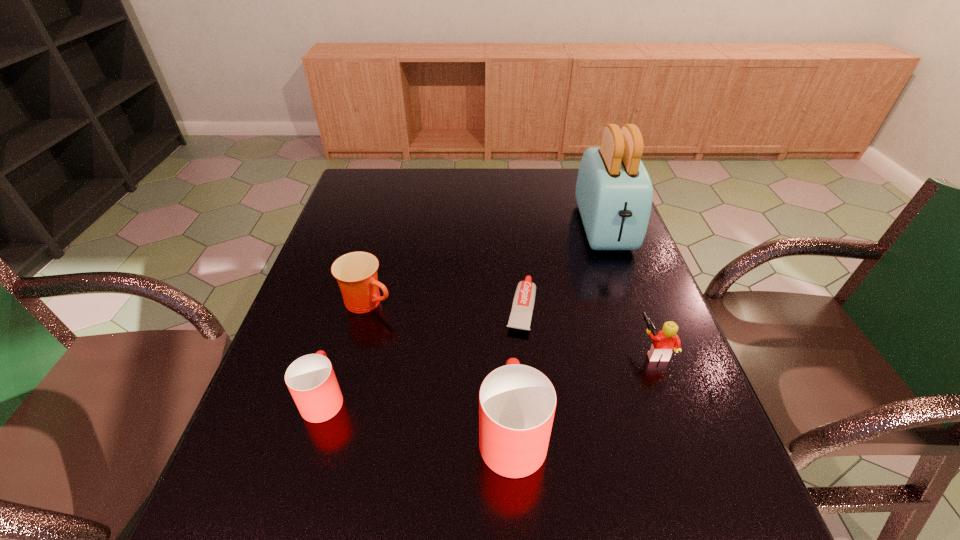
Where is `free spot located on the side of the farthest object with the lever`? Image resolution: width=960 pixels, height=540 pixels. free spot located on the side of the farthest object with the lever is located at coordinates (658, 379).

You are a GUI agent. You are given a task and a screenshot of the screen. Output one action in this format:
    pyautogui.click(x=<x>, y=<y>)
    Task: Click on the blank area located in front of the Lego with the accessory visible
    The height and width of the screenshot is (540, 960).
    Given the screenshot: What is the action you would take?
    pyautogui.click(x=546, y=350)

At what (x,y) coordinates should I click in order to perform the action: click on free spot located in front of the Lego with the accessory visible. Please return your answer as a coordinate pair (x, y). Image resolution: width=960 pixels, height=540 pixels. Looking at the image, I should click on pyautogui.click(x=594, y=350).

This screenshot has height=540, width=960. Find the location of `vacant region located in front of the Lego with the accessory visible`. vacant region located in front of the Lego with the accessory visible is located at coordinates (497, 350).

At what (x,y) coordinates should I click in order to perform the action: click on free spot located 0.070m on the back of the toothpaste. Please return your answer as a coordinate pair (x, y). Image resolution: width=960 pixels, height=540 pixels. Looking at the image, I should click on (517, 266).

What are the coordinates of `vacant region located on the right of the farthest cup` in the screenshot? It's located at (420, 302).

Identify the location of object that is at the far edge. (614, 193).

You are a GUI agent. You are given a task and a screenshot of the screen. Output one action in this format:
    pyautogui.click(x=<x>, y=<y>)
    Task: Click on the object that is at the near edge
    
    Given the screenshot: What is the action you would take?
    pyautogui.click(x=517, y=403)

Locate an element on the screen. This screenshot has width=960, height=540. toaster located in the right edge section of the desktop is located at coordinates (614, 193).

Where is `Lego that is at the right edge`? Lego that is at the right edge is located at coordinates (664, 342).